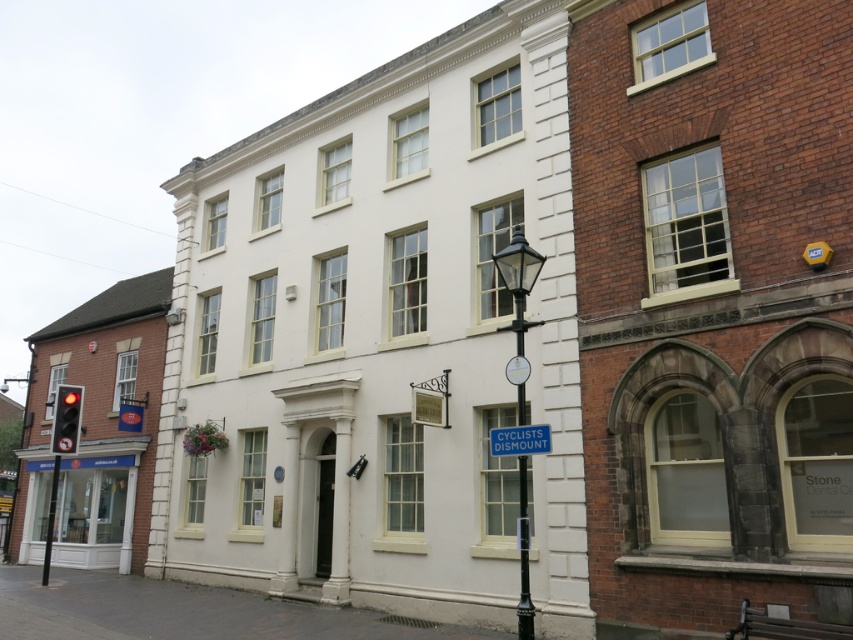
Who is shorter, black polished metal streetlamp at center or blue plastic sign at center?

blue plastic sign at center

Is black polished metal streetlamp at center positioned at the back of blue plastic sign at center?

Yes, black polished metal streetlamp at center is further from the viewer.

Locate an element on the screen. This screenshot has width=853, height=640. black polished metal streetlamp at center is located at coordinates (518, 278).

Is black polished metal streetlamp at center bigger than green metallic pole at center?

Yes.

The image size is (853, 640). What do you see at coordinates (518, 278) in the screenshot? I see `black polished metal streetlamp at center` at bounding box center [518, 278].

You are a GUI agent. You are given a task and a screenshot of the screen. Output one action in this format:
    pyautogui.click(x=<x>, y=<y>)
    Task: Click on the black polished metal streetlamp at center
    
    Given the screenshot: What is the action you would take?
    pyautogui.click(x=518, y=278)

Does point (511, 330) come behind point (521, 436)?

Yes.

Which is behind, point (519, 618) or point (502, 442)?

The point (519, 618) is more distant.

Image resolution: width=853 pixels, height=640 pixels. Identify the location of green metallic pole at center. [523, 557].